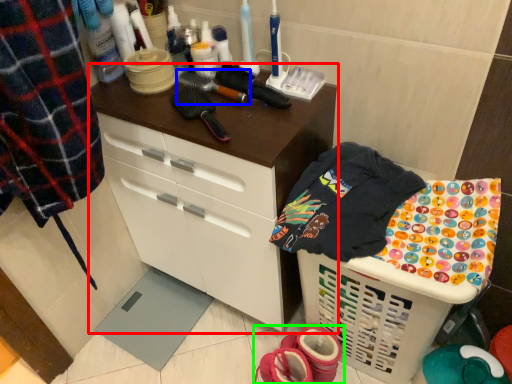
Question: Which object is positioned closest to cabinetry (highlighted by a red box)? Select from brush (highlighted by a blue box) and footwear (highlighted by a green box).

Choices:
 (A) brush
 (B) footwear

Answer: (A)